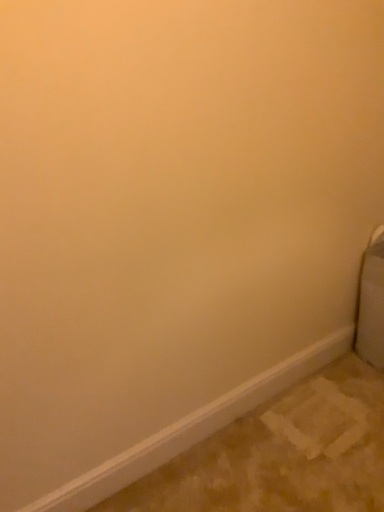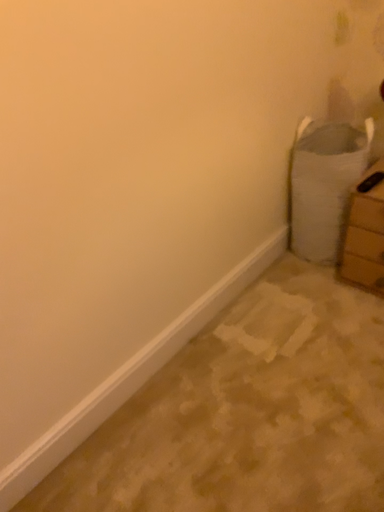
Question: How did the camera likely rotate when shooting the video?

Choices:
 (A) rotated downward
 (B) rotated upward

Answer: (A)